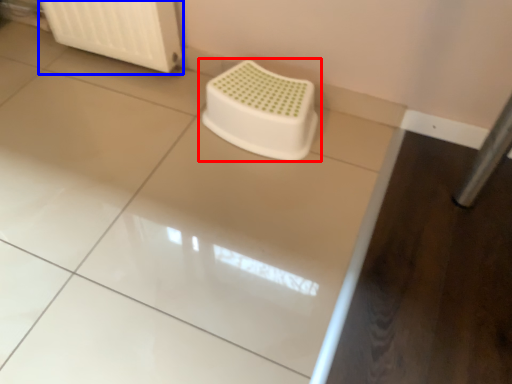
Question: Which of the following is the closest to the observer, toilet (highlighted by a red box) or radiator (highlighted by a blue box)?

Choices:
 (A) toilet
 (B) radiator

Answer: (A)